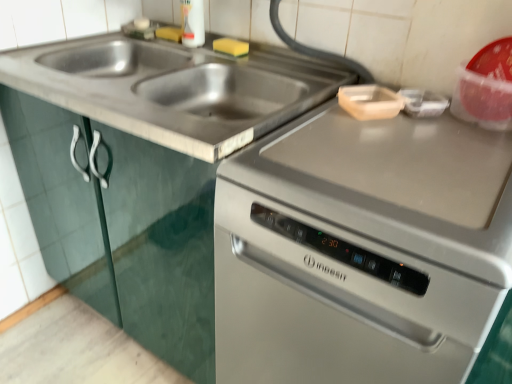
At what (x,y) coordinates should I click in order to perform the action: click on free point above satin silver oven at right (from a real-world perspective). Please return your answer as a coordinate pair (x, y). Looking at the image, I should click on (403, 147).